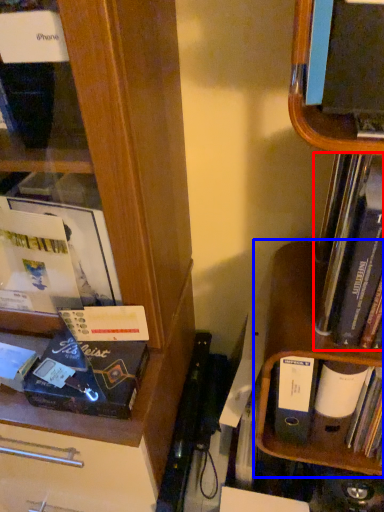
Question: Which of the following is the closest to the observer, book (highlighted by a red box) or cabinet (highlighted by a blue box)?

Choices:
 (A) book
 (B) cabinet

Answer: (A)